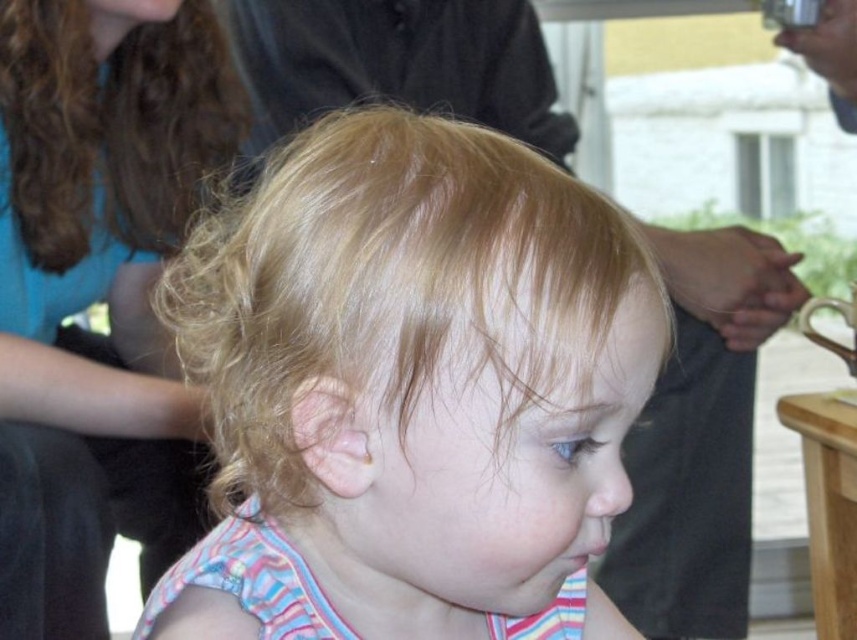
Question: Observing the image, what is the correct spatial positioning of blonde hair at center in reference to curly brown hair at upper left?

Choices:
 (A) below
 (B) above

Answer: (A)

Question: Does blonde hair at center have a larger size compared to curly brown hair at upper left?

Choices:
 (A) no
 (B) yes

Answer: (B)

Question: Among these points, which one is farthest from the camera?

Choices:
 (A) (378, 515)
 (B) (228, 77)
 (C) (184, 86)

Answer: (B)

Question: Which of the following is the closest to the observer?

Choices:
 (A) curly brown hair at upper left
 (B) blonde hair at upper left
 (C) blonde hair at center

Answer: (C)

Question: Can you confirm if blonde hair at center is smaller than blonde hair at upper left?

Choices:
 (A) no
 (B) yes

Answer: (A)

Question: Which point appears closest to the camera in this image?

Choices:
 (A) [213, 305]
 (B) [52, 156]

Answer: (A)